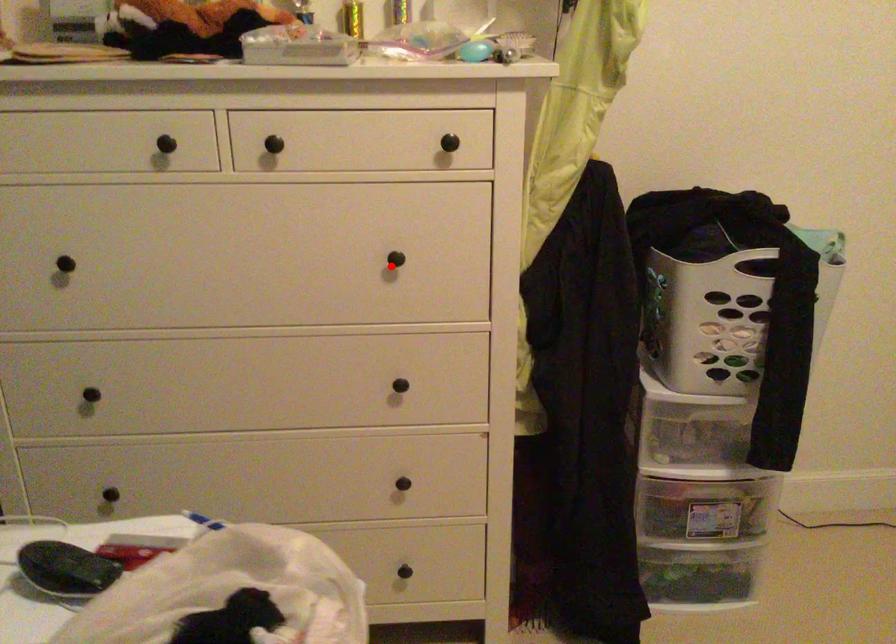
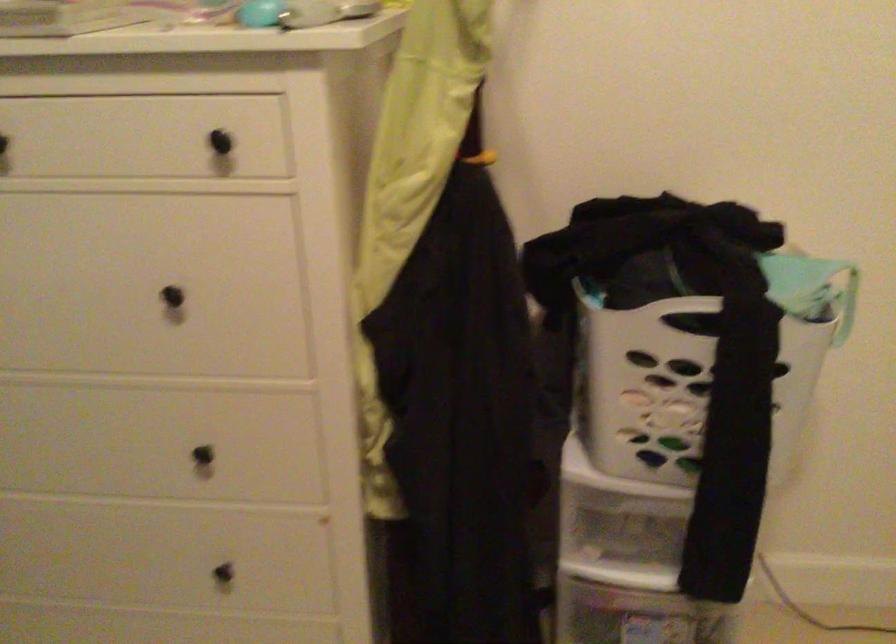
Question: I am providing you with two images of the same scene from different viewpoints. Given a red point in image1, look at the same physical point in image2. Is it:

Choices:
 (A) Closer to the viewpoint
 (B) Farther from the viewpoint

Answer: (A)